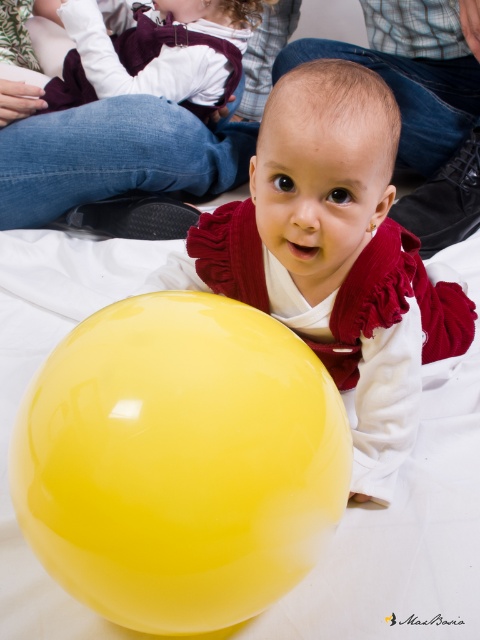
Is point (333, 401) behind point (402, 365)?

No, (333, 401) is closer to viewer.

Between glossy yellow balloon at center and glossy yellow ball at lower left, which one appears on the left side from the viewer's perspective?

Positioned to the left is glossy yellow balloon at center.

Image resolution: width=480 pixels, height=640 pixels. Find the location of `glossy yellow balloon at center`. glossy yellow balloon at center is located at coordinates (180, 461).